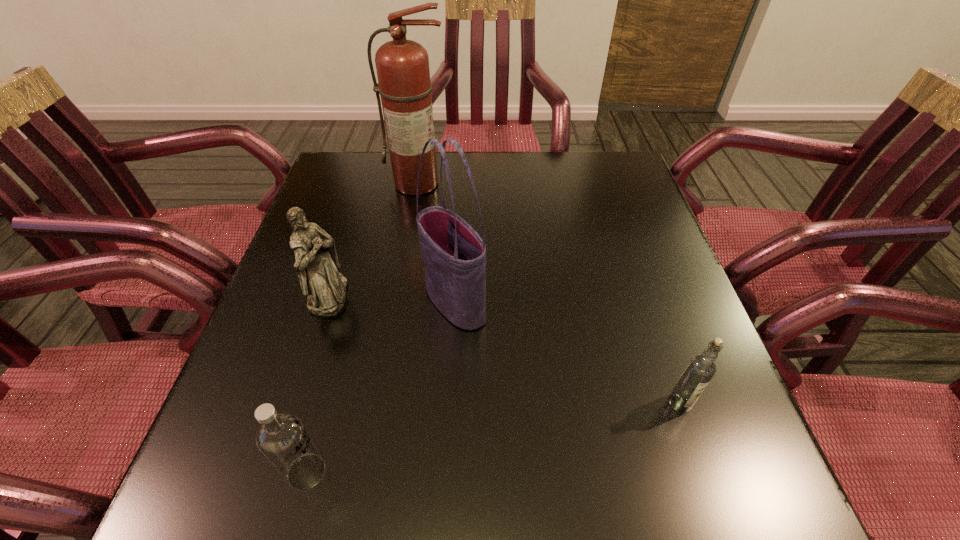
This screenshot has height=540, width=960. I want to click on free spot between the left vodka and the tallest object, so click(362, 328).

You are a GUI agent. You are given a task and a screenshot of the screen. Output one action in this format:
    pyautogui.click(x=<x>, y=<y>)
    Task: Click on the vacant area that lies between the tallest object and the farther vodka
    This screenshot has width=960, height=540.
    Given the screenshot: What is the action you would take?
    pyautogui.click(x=549, y=293)

The image size is (960, 540). Find the location of `vacant area between the left vodka and the fourth farthest object`. vacant area between the left vodka and the fourth farthest object is located at coordinates (493, 437).

Locate an element on the screen. The width and height of the screenshot is (960, 540). the second closest object to the fourth shortest object is located at coordinates (282, 438).

At what (x,y) coordinates should I click in order to perform the action: click on the second closest object to the figurine. Please return your answer as a coordinate pair (x, y). Looking at the image, I should click on (282, 438).

The image size is (960, 540). Identify the location of blank space that satisfies the following two spatial constraints: 1. on the front-facing side of the fourth shortest object; 2. on the right side of the farthest object. (397, 302).

At what (x,y) coordinates should I click in order to perform the action: click on free region that satisfies the following two spatial constraints: 1. on the front-facing side of the tote bag; 2. on the right side of the fire extinguisher. Please return your answer as a coordinate pair (x, y). The image size is (960, 540). Looking at the image, I should click on (397, 302).

Identify the location of vacant space that satisfies the following two spatial constraints: 1. on the front-facing side of the tallest object; 2. on the left side of the tote bag. Image resolution: width=960 pixels, height=540 pixels. (397, 302).

Locate an element on the screen. vacant space that satisfies the following two spatial constraints: 1. on the front-facing side of the tote bag; 2. on the left side of the figurine is located at coordinates (326, 302).

This screenshot has width=960, height=540. I want to click on vacant space that satisfies the following two spatial constraints: 1. on the front-facing side of the fourth shortest object; 2. on the left side of the figurine, so click(x=326, y=302).